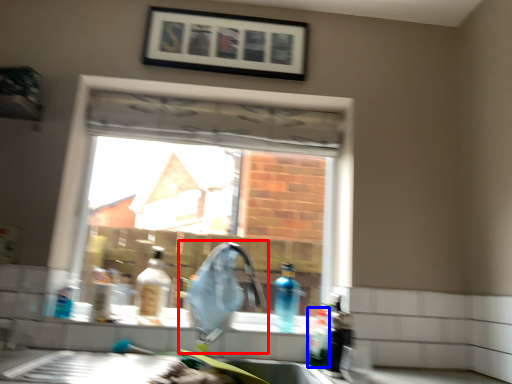
Question: Which object is further to the camera taking this photo, faucet (highlighted by a red box) or bottle (highlighted by a blue box)?

Choices:
 (A) faucet
 (B) bottle

Answer: (B)